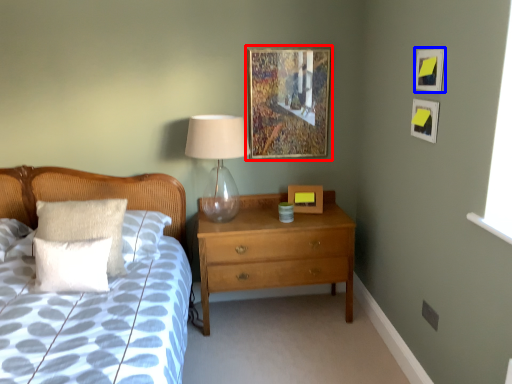
Question: Which point is closer to the camera, picture frame (highlighted by a red box) or picture frame (highlighted by a blue box)?

Choices:
 (A) picture frame
 (B) picture frame

Answer: (B)